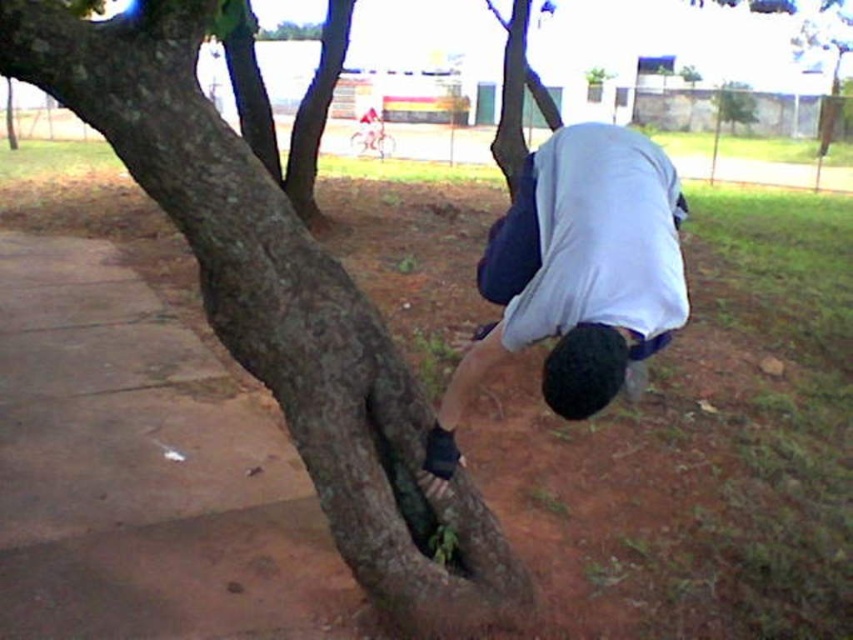
Does point (538, 220) lie in front of point (247, 116)?

Yes, it is in front of point (247, 116).

Which of these two, white matte shirt at center or brown rough bark at center, stands taller?

With more height is brown rough bark at center.

Which is in front, point (592, 275) or point (341, 48)?

Positioned in front is point (592, 275).

Find the location of a particular element. white matte shirt at center is located at coordinates (577, 273).

Can you confirm if brown rough tree trunk at center is shorter than brown rough bark at center?

Yes, brown rough tree trunk at center is shorter than brown rough bark at center.

Is point (215, 260) farther from camera compared to point (300, 193)?

No, (215, 260) is closer to viewer.

Is point (410, 406) positioned after point (236, 45)?

No, it is not.

Image resolution: width=853 pixels, height=640 pixels. Find the location of `brown rough tree trunk at center`. brown rough tree trunk at center is located at coordinates (277, 308).

Does brown rough tree trunk at center appear on the left side of green rough bark tree at upper center?

Correct, you'll find brown rough tree trunk at center to the left of green rough bark tree at upper center.

Measure the distance between point (346, 336) and camera.

Point (346, 336) and camera are 1.64 meters apart from each other.

The width and height of the screenshot is (853, 640). What are the coordinates of `brown rough tree trunk at center` in the screenshot? It's located at (277, 308).